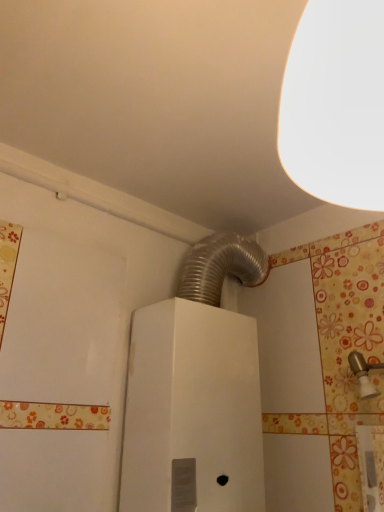
Question: Does white matte lampshade at upper right have a lesser height compared to brushed metal faucet at upper right?

Choices:
 (A) no
 (B) yes

Answer: (A)

Question: Is white matte lampshade at upper right oriented away from brushed metal faucet at upper right?

Choices:
 (A) yes
 (B) no

Answer: (B)

Question: Can you confirm if white matte lampshade at upper right is smaller than brushed metal faucet at upper right?

Choices:
 (A) no
 (B) yes

Answer: (A)

Question: Would you say brushed metal faucet at upper right is part of white matte lampshade at upper right's contents?

Choices:
 (A) yes
 (B) no

Answer: (B)

Question: Considering the relative sizes of white matte lampshade at upper right and brushed metal faucet at upper right in the image provided, is white matte lampshade at upper right taller than brushed metal faucet at upper right?

Choices:
 (A) no
 (B) yes

Answer: (B)

Question: From the image's perspective, is brushed metal faucet at upper right located above or below white matte lampshade at upper right?

Choices:
 (A) below
 (B) above

Answer: (A)

Question: Is brushed metal faucet at upper right spatially inside white matte lampshade at upper right, or outside of it?

Choices:
 (A) outside
 (B) inside

Answer: (A)

Question: Is brushed metal faucet at upper right taller or shorter than white matte lampshade at upper right?

Choices:
 (A) short
 (B) tall

Answer: (A)

Question: From a real-world perspective, is brushed metal faucet at upper right above or below white matte lampshade at upper right?

Choices:
 (A) above
 (B) below

Answer: (B)

Question: Relative to brushed metal faucet at upper right, is white matte lampshade at upper right in front or behind?

Choices:
 (A) behind
 (B) front

Answer: (B)

Question: From their relative heights in the image, would you say white matte lampshade at upper right is taller or shorter than brushed metal faucet at upper right?

Choices:
 (A) short
 (B) tall

Answer: (B)

Question: Is white matte lampshade at upper right to the left or to the right of brushed metal faucet at upper right in the image?

Choices:
 (A) right
 (B) left

Answer: (B)

Question: Is point (314, 145) positioned closer to the camera than point (355, 370)?

Choices:
 (A) closer
 (B) farther

Answer: (A)

Question: Considering their positions, is brushed metal faucet at upper right located in front of or behind white metallic water heater at center?

Choices:
 (A) front
 (B) behind

Answer: (A)

Question: From a real-world perspective, is brushed metal faucet at upper right physically located above or below white metallic water heater at center?

Choices:
 (A) below
 (B) above

Answer: (A)